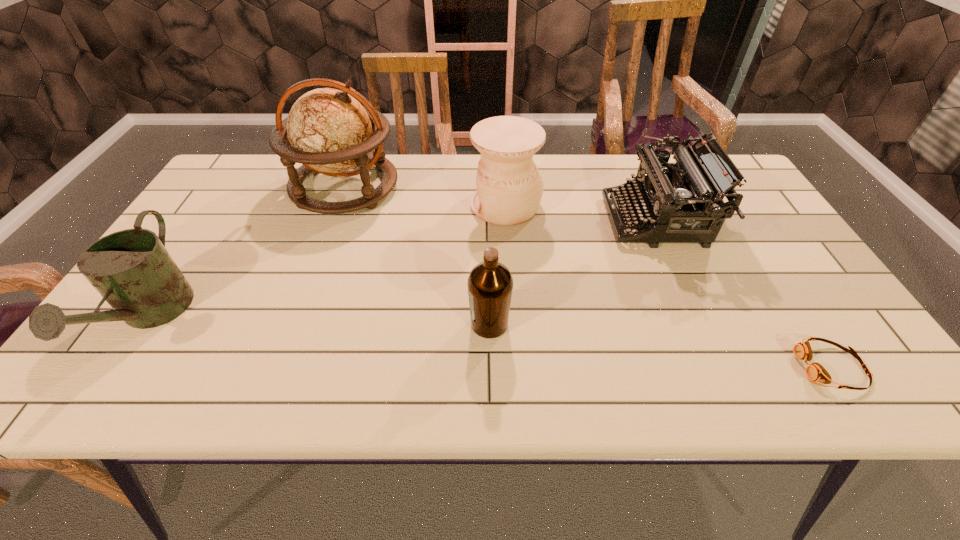
Locate an element on the screen. This screenshot has width=960, height=540. free space between the olive oil and the watering can is located at coordinates (320, 321).

Find the location of a particular element. This screenshot has height=540, width=960. free spot between the goggles and the tallest object is located at coordinates (588, 277).

At what (x,y) coordinates should I click in order to perform the action: click on vacant space that's between the olive oil and the goggles. Please return your answer as a coordinate pair (x, y). This screenshot has height=540, width=960. Looking at the image, I should click on (660, 346).

I want to click on blank region between the goggles and the globe, so click(x=588, y=277).

Identify which object is the fifth closest to the pottery. Please provide its 2D coordinates. Your answer should be formatted as a tuple, i.e. [(x, y)], where the tuple contains the x and y coordinates of a point satisfying the conditions above.

[(131, 269)]

Locate an element on the screen. The width and height of the screenshot is (960, 540). the second closest object relative to the pottery is located at coordinates (329, 131).

Locate an element on the screen. free region that satisfies the following two spatial constraints: 1. at the open side of the pottery; 2. with the spout on the watering can is located at coordinates (513, 318).

What are the coordinates of `blank space that satisfies the following two spatial constraints: 1. at the open side of the pottery; 2. with the spout on the watering can` in the screenshot? It's located at point(513,318).

In order to click on free space that satisfies the following two spatial constraints: 1. at the open side of the pottery; 2. with the spout on the watering can in this screenshot , I will do `click(513, 318)`.